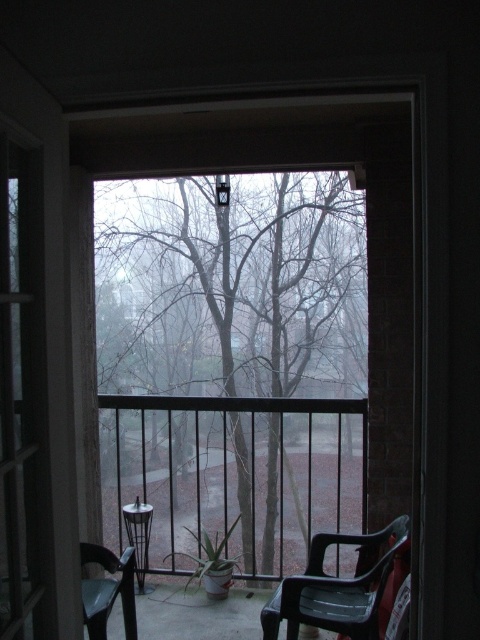
Question: Considering the real-world distances, which object is closest to the translucent plastic chair at lower right?

Choices:
 (A) bare branches at center
 (B) transparent plastic screen door at left

Answer: (B)

Question: Is transparent plastic screen door at left smaller than metallic plastic chair at lower left?

Choices:
 (A) no
 (B) yes

Answer: (B)

Question: Considering the real-world distances, which object is closest to the transparent plastic screen door at left?

Choices:
 (A) translucent plastic chair at lower right
 (B) metallic plastic chair at lower left
 (C) bare branches at center

Answer: (B)

Question: Does black metal railing at center have a lesser width compared to transparent plastic screen door at left?

Choices:
 (A) yes
 (B) no

Answer: (B)

Question: Which point is farther from the camera taking this photo?

Choices:
 (A) (126, 588)
 (B) (266, 259)

Answer: (B)

Question: Considering the relative positions of translucent plastic chair at lower right and metallic plastic chair at lower left in the image provided, where is translucent plastic chair at lower right located with respect to metallic plastic chair at lower left?

Choices:
 (A) above
 (B) below

Answer: (A)